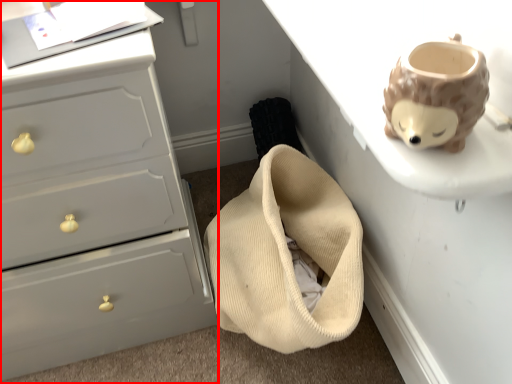
Question: From the image's perspective, what is the correct spatial positioning of chest of drawers (annotated by the red box) in reference to table?

Choices:
 (A) above
 (B) below

Answer: (B)